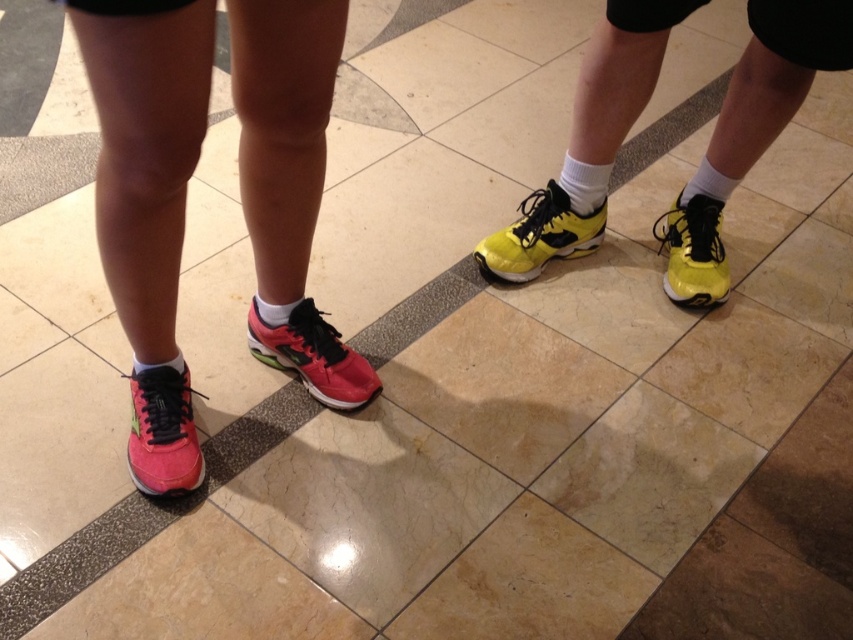
You are standing in a room with two people whose legs are visible on the tiled floor. You see a point marked at coordinates point (576, 180). If you want to reach that point quickly, which direction should you move towards?

The point (576, 180) is 5.80 feet away from the viewer, so you should move forward towards it to reach it quickly.

You are trying to decide which pair of shoes to take for your run. Both the pink matte running shoe at lower left and the shiny pink running shoe at lower left are options. Based on their sizes, which one might be more comfortable for a long run?

The pink matte running shoe at lower left has a smaller width than the shiny pink running shoe at lower left, so the shiny pink running shoe at lower left might be more comfortable for a long run due to its wider fit.